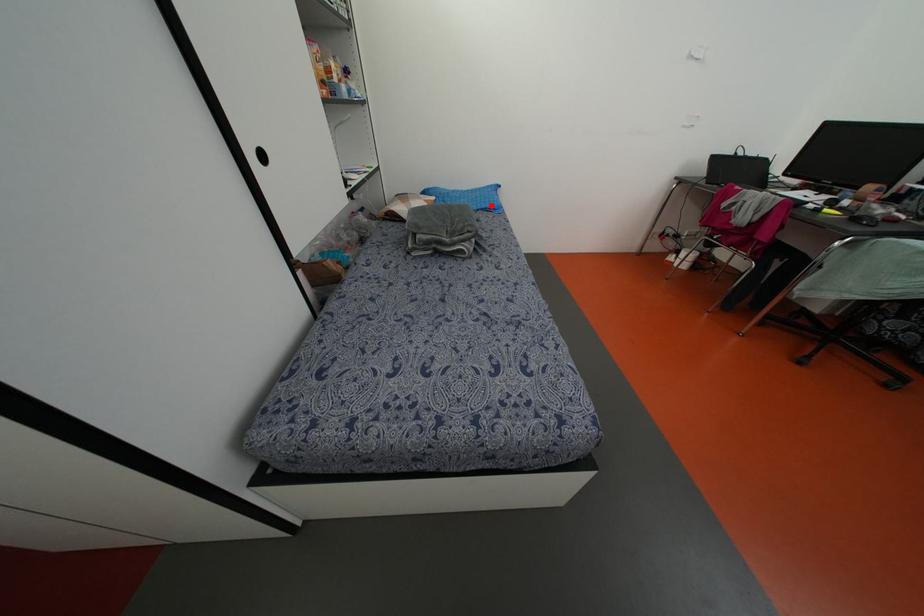
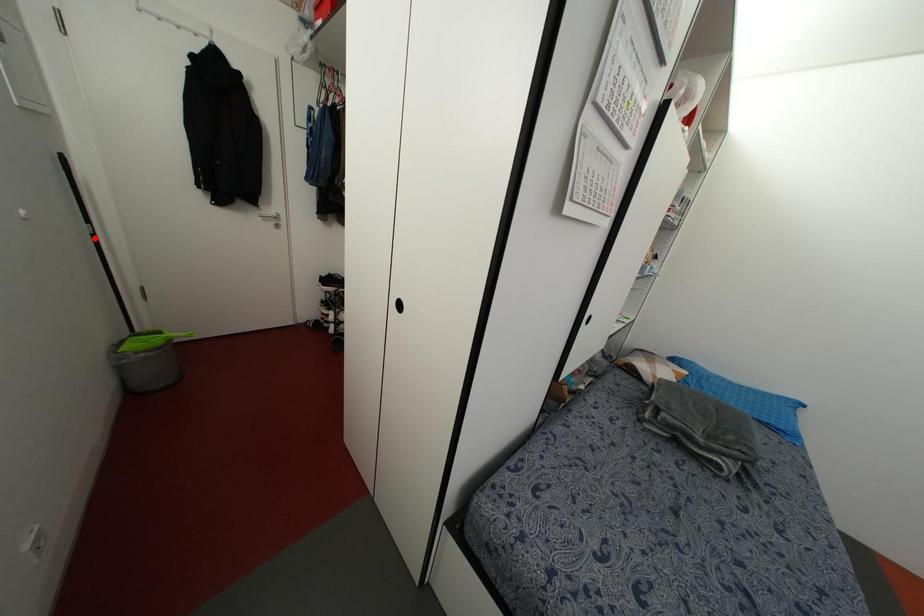
Consider the image. I am providing you with two images of the same scene from different viewpoints. A red point is marked on the first image and another point is marked on the second image. Is the marked point in image1 the same physical position as the marked point in image2?

Result: No